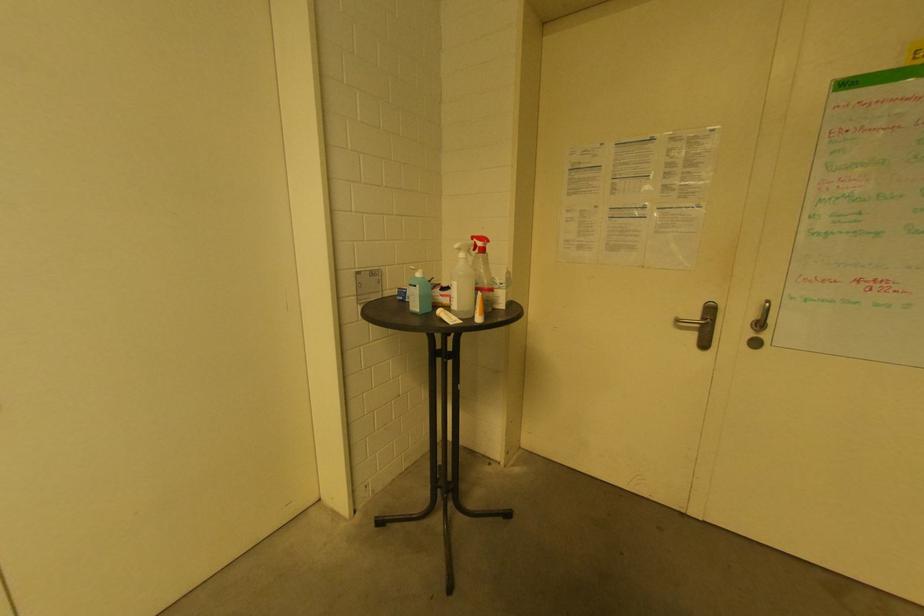
The width and height of the screenshot is (924, 616). Find the location of `white pump dispenser`. white pump dispenser is located at coordinates (447, 270).